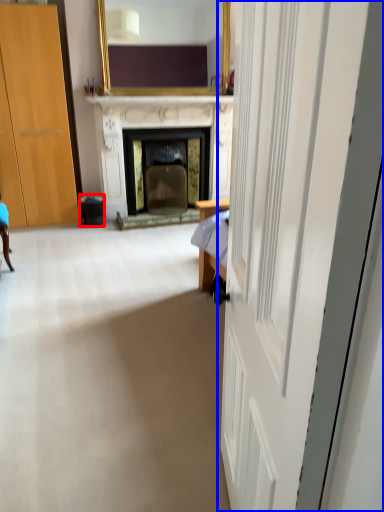
Question: Which object appears farthest to the camera in this image, trash bin/can (highlighted by a red box) or door (highlighted by a blue box)?

Choices:
 (A) trash bin/can
 (B) door

Answer: (A)